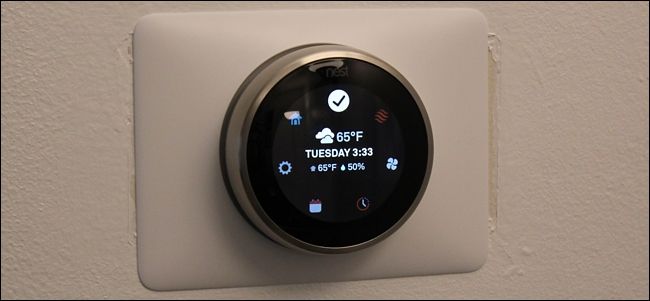
At what (x,y) coordinates should I click in order to perform the action: click on screen. Please return your answer as a coordinate pair (x, y). This screenshot has height=301, width=650. Looking at the image, I should click on (378, 180).